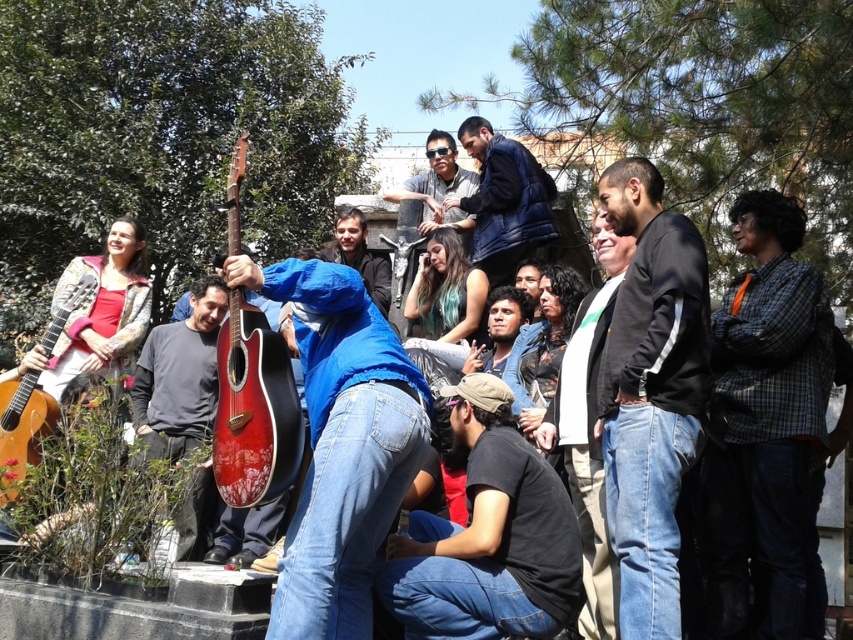
Consider the image. Who is lower down, glossy wood guitar at center or blue denim jeans at center?

blue denim jeans at center

The height and width of the screenshot is (640, 853). Describe the element at coordinates (254, 410) in the screenshot. I see `glossy wood guitar at center` at that location.

Where is `glossy wood guitar at center`? glossy wood guitar at center is located at coordinates (254, 410).

Does glossy wood guitar at center have a smaller size compared to blue denim jacket at center?

Incorrect, glossy wood guitar at center is not smaller in size than blue denim jacket at center.

Is glossy wood guitar at center shorter than blue denim jacket at center?

No, glossy wood guitar at center is not shorter than blue denim jacket at center.

Does point (222, 326) come farther from viewer compared to point (465, 212)?

That is False.

This screenshot has height=640, width=853. I want to click on glossy wood guitar at center, so click(x=254, y=410).

Does black cotton jacket at center have a greater height compared to acoustic wood guitar at left?

Yes.

Can you confirm if black cotton jacket at center is wider than acoustic wood guitar at left?

No, black cotton jacket at center is not wider than acoustic wood guitar at left.

This screenshot has height=640, width=853. What are the coordinates of `black cotton jacket at center` in the screenshot? It's located at (651, 394).

You are a GUI agent. You are given a task and a screenshot of the screen. Output one action in this format:
    pyautogui.click(x=<x>, y=<y>)
    Task: Click on the black cotton jacket at center
    Image resolution: width=853 pixels, height=640 pixels.
    Given the screenshot: What is the action you would take?
    pyautogui.click(x=651, y=394)